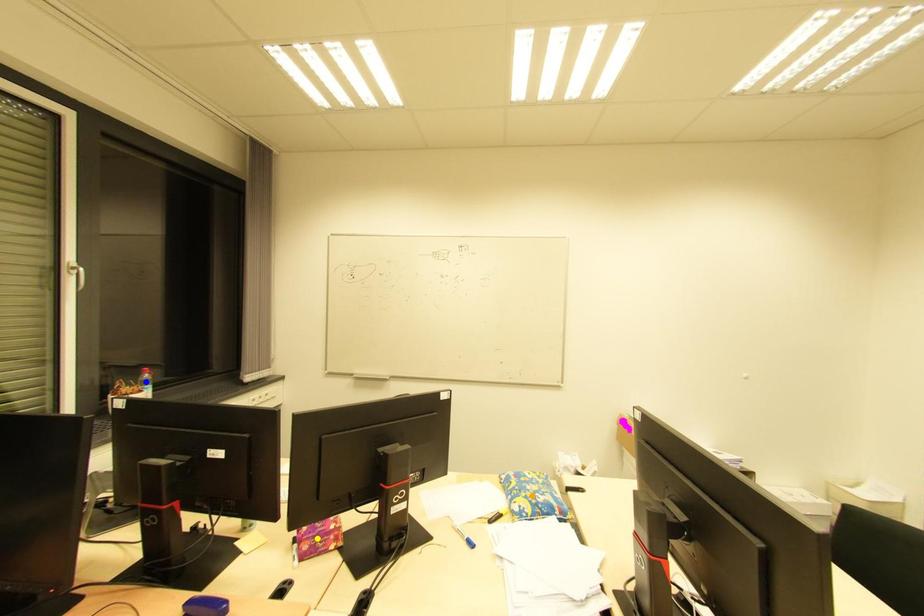
Order these from farthest to nearest:
1. orange point
2. blue point
3. yellow point

blue point, orange point, yellow point